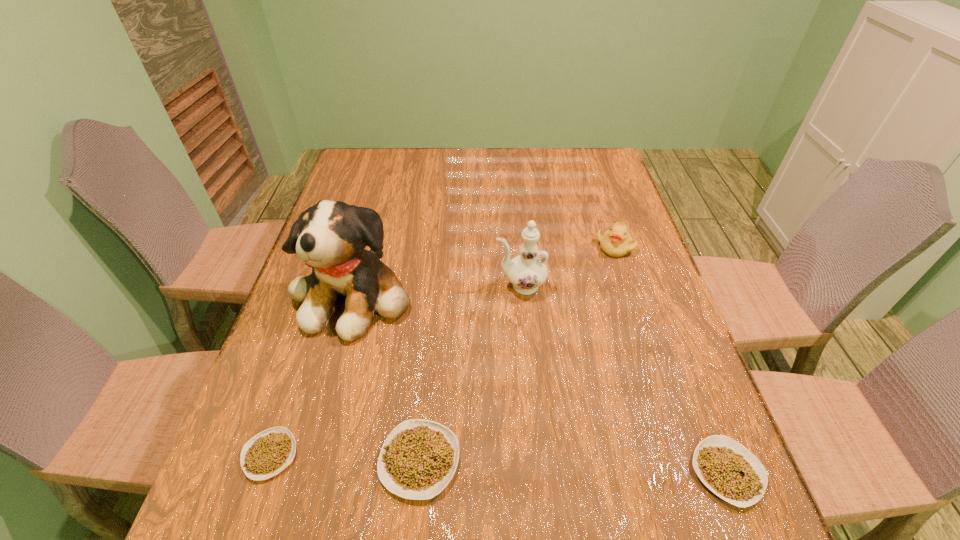
Image resolution: width=960 pixels, height=540 pixels. I want to click on vacant area between the shortest legume and the second legume from left to right, so pos(345,457).

The height and width of the screenshot is (540, 960). I want to click on free space between the chinaware and the puppy, so click(x=437, y=290).

Where is `empty space between the tallest object and the third object from right to left`? This screenshot has height=540, width=960. empty space between the tallest object and the third object from right to left is located at coordinates (437, 290).

You are a GUI agent. You are given a task and a screenshot of the screen. Output one action in this format:
    pyautogui.click(x=<x>, y=<y>)
    Task: Click on the blank region between the duckling and the second tallest object
    Image resolution: width=960 pixels, height=540 pixels.
    Given the screenshot: What is the action you would take?
    pyautogui.click(x=567, y=266)

This screenshot has width=960, height=540. I want to click on free space between the duckling and the second legume from left to right, so 517,353.

You are a GUI agent. You are given a task and a screenshot of the screen. Output one action in this format:
    pyautogui.click(x=<x>, y=<y>)
    Task: Click on the free space between the duckling and the fifth tallest object
    The width and height of the screenshot is (960, 540).
    Given the screenshot: What is the action you would take?
    pyautogui.click(x=671, y=359)

Where is `unoccupied area between the shortest object and the chinaware`? The image size is (960, 540). unoccupied area between the shortest object and the chinaware is located at coordinates (396, 370).

The image size is (960, 540). In order to click on vacant space that is in between the shortest legume and the tallest object in this screenshot , I will do tap(312, 374).

I want to click on free space between the puppy and the duckling, so click(485, 271).

Select which object is the second closest to the tallest object. Please provide its 2D coordinates. Your answer should be formatted as a tuple, i.e. [(x, y)], where the tuple contains the x and y coordinates of a point satisfying the conditions above.

[(269, 452)]